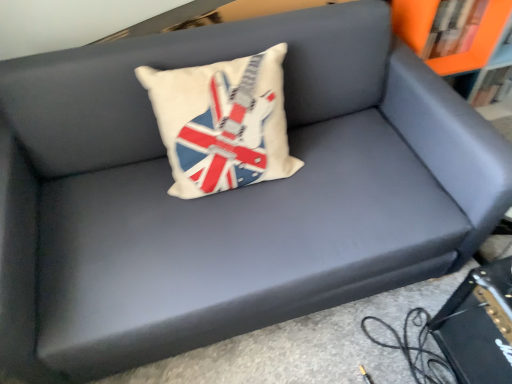
Question: In the image, is orange matte bookshelf at upper right positioned in front of or behind black leather book at lower right?

Choices:
 (A) behind
 (B) front

Answer: (A)

Question: Is point (450, 33) positioned closer to the camera than point (459, 375)?

Choices:
 (A) farther
 (B) closer

Answer: (A)

Question: Which of these objects is positioned closest to the white fabric pillow with union jack design at center?

Choices:
 (A) orange matte bookshelf at upper right
 (B) orange matte bookcase at upper right
 (C) black leather book at lower right

Answer: (C)

Question: Based on their relative distances, which object is nearer to the black leather book at lower right?

Choices:
 (A) white fabric pillow with union jack design at center
 (B) orange matte bookshelf at upper right
 (C) orange matte bookcase at upper right

Answer: (A)